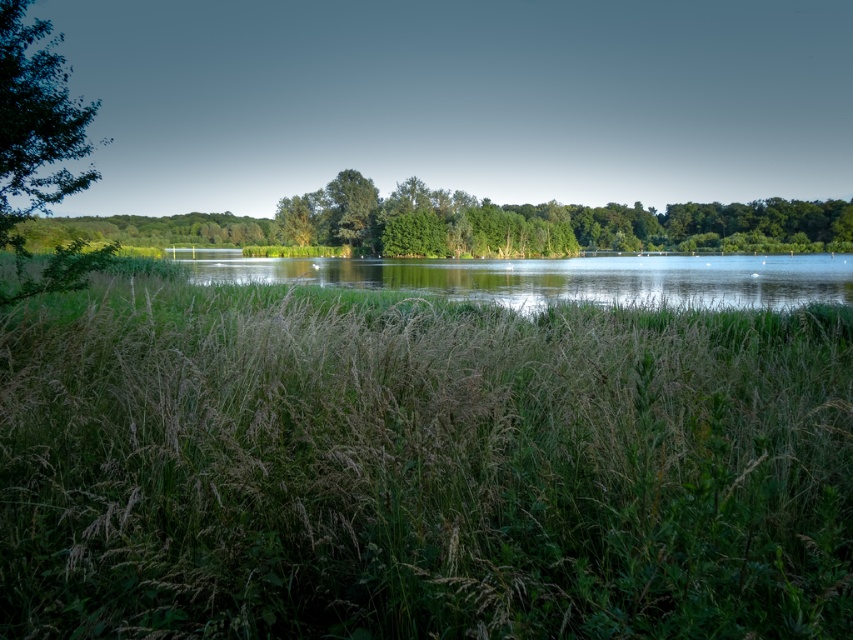
Who is positioned more to the right, green grass at center or green leafy tree at left?

Positioned to the right is green grass at center.

Find the location of `green grass at center`. green grass at center is located at coordinates (419, 467).

Between green leafy tree at center and green leafy tree at left, which one has less height?

Standing shorter between the two is green leafy tree at left.

Consider the image. Does green leafy tree at center have a smaller size compared to green leafy tree at left?

Actually, green leafy tree at center might be larger than green leafy tree at left.

Is point (384, 225) closer to camera compared to point (10, 19)?

No, (384, 225) is behind (10, 19).

Identify the location of green leafy tree at center. (473, 225).

Between green grass at center and green leafy tree at center, which one has more height?

green leafy tree at center is taller.

Does green grass at center appear under green leafy tree at center?

Yes, green grass at center is below green leafy tree at center.

Who is more distant from viewer, (527,336) or (454,227)?

The point (454,227) is more distant.

Find the location of `green grass at center`. green grass at center is located at coordinates (419, 467).